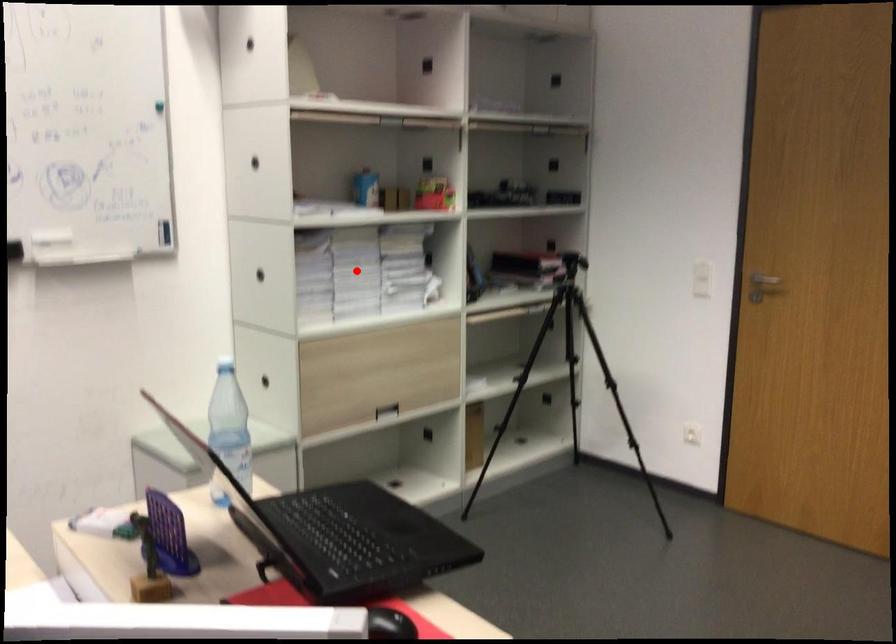
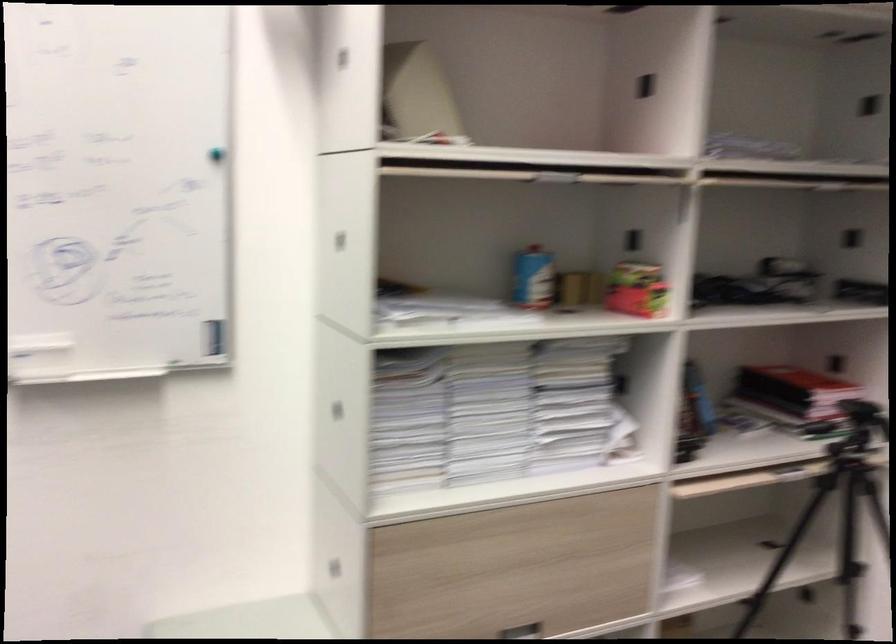
Where in the second image is the point corresponding to the highlighted location from the first image?

(489, 412)